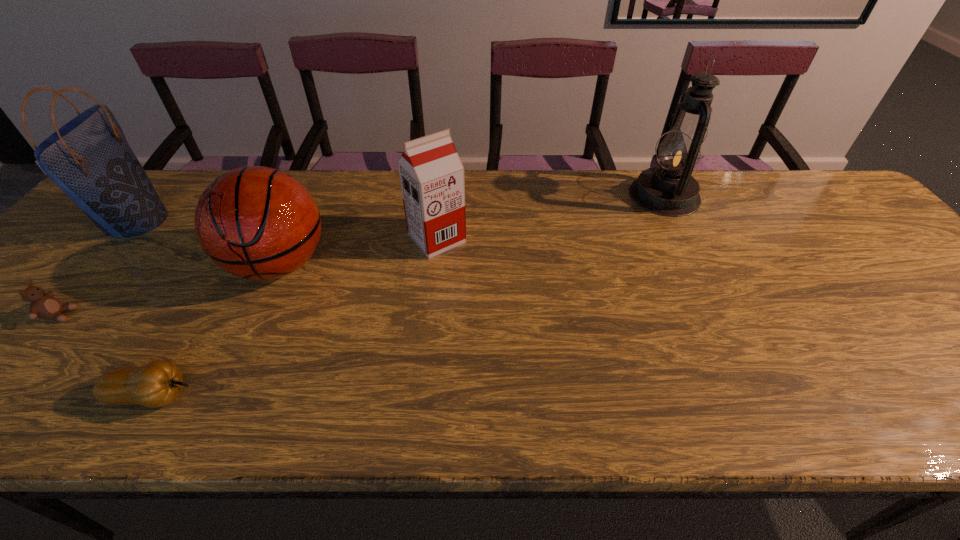
The width and height of the screenshot is (960, 540). I want to click on oil lamp, so click(x=669, y=190).

Identify the location of shopping bag. The image size is (960, 540). (89, 158).

Where is `soya milk`? Image resolution: width=960 pixels, height=540 pixels. soya milk is located at coordinates (431, 173).

I want to click on basketball, so click(x=258, y=223).

Locate an element on the screen. This screenshot has height=540, width=960. teddy bear is located at coordinates (43, 305).

Identify the location of the nearest object. (158, 383).

Locate an element on the screen. Image resolution: width=960 pixels, height=540 pixels. vacant region located 0.370m on the right of the oil lamp is located at coordinates (825, 195).

The width and height of the screenshot is (960, 540). I want to click on free region located on the front of the shopping bag, so click(84, 282).

Locate an element on the screen. vacant space located on the front of the fifth object from left to right is located at coordinates (425, 356).

Locate an element on the screen. The height and width of the screenshot is (540, 960). blank space located on the side with spill of the basketball is located at coordinates [244, 343].